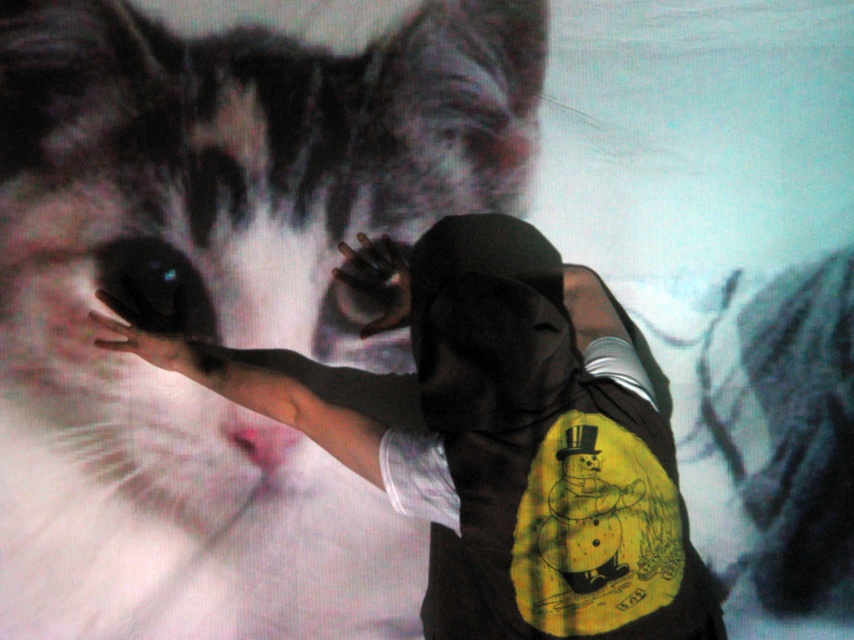
Does black matte t-shirt at center have a lesser width compared to black matte hand at center?

No, black matte t-shirt at center is not thinner than black matte hand at center.

Between black matte t-shirt at center and black matte hand at center, which one has less height?

With less height is black matte hand at center.

Does point (574, 451) come in front of point (392, 257)?

Yes, point (574, 451) is in front of point (392, 257).

The height and width of the screenshot is (640, 854). I want to click on black matte t-shirt at center, so click(x=509, y=444).

Is white fur cat at center thinner than black matte t-shirt at center?

Incorrect, white fur cat at center's width is not less than black matte t-shirt at center's.

Between point (458, 122) and point (494, 445), which one is positioned in front?

Point (494, 445) is more forward.

Identify the location of white fur cat at center. (218, 301).

Who is shorter, gray textured fur at upper right or black matte glove at center?

black matte glove at center is shorter.

What do you see at coordinates (785, 436) in the screenshot? I see `gray textured fur at upper right` at bounding box center [785, 436].

Where is `gray textured fur at upper right`? gray textured fur at upper right is located at coordinates (785, 436).

The image size is (854, 640). Find the location of `gray textured fur at upper right`. gray textured fur at upper right is located at coordinates tap(785, 436).